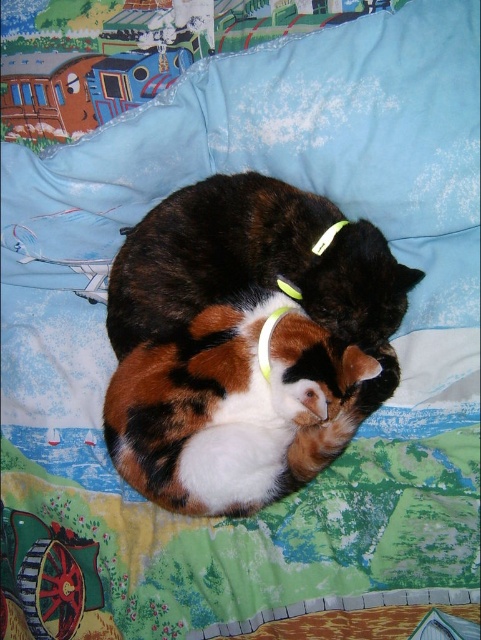
Does neon yellow fabric at center appear under yellow fabric neckband at center?

No, neon yellow fabric at center is not below yellow fabric neckband at center.

Between neon yellow fabric at center and yellow fabric neckband at center, which one appears on the left side from the viewer's perspective?

From the viewer's perspective, yellow fabric neckband at center appears more on the left side.

Which is in front, point (293, 291) or point (278, 316)?

Point (278, 316)

The height and width of the screenshot is (640, 481). In order to click on neon yellow fabric at center in this screenshot , I will do `click(267, 339)`.

Who is more distant from viewer, (114, 269) or (267, 362)?

Point (114, 269)

In the scene shown: Is calico fur cat at center wider than yellow fabric neckband at center?

Indeed, calico fur cat at center has a greater width compared to yellow fabric neckband at center.

What do you see at coordinates (244, 342) in the screenshot? This screenshot has height=640, width=481. I see `calico fur cat at center` at bounding box center [244, 342].

The height and width of the screenshot is (640, 481). What are the coordinates of `calico fur cat at center` in the screenshot? It's located at (244, 342).

Does calico fur cat at center appear on the left side of neon yellow fabric at center?

Indeed, calico fur cat at center is positioned on the left side of neon yellow fabric at center.

Does calico fur cat at center have a larger size compared to neon yellow fabric at center?

Yes.

Who is more forward, (113,273) or (266,330)?

Positioned in front is point (266,330).

This screenshot has height=640, width=481. In order to click on calico fur cat at center in this screenshot , I will do `click(244, 342)`.